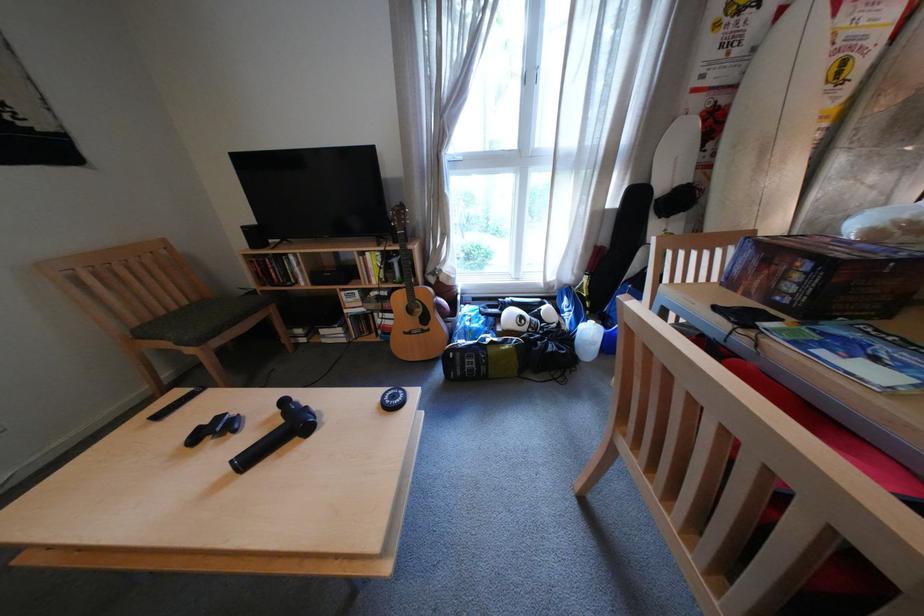
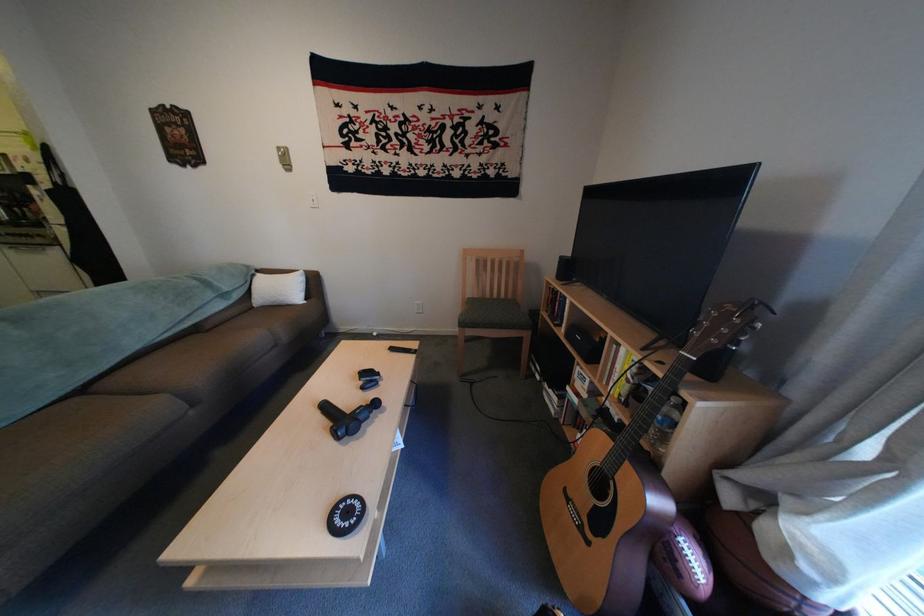
How did the camera likely rotate?

The rotation direction of the camera is left-down.